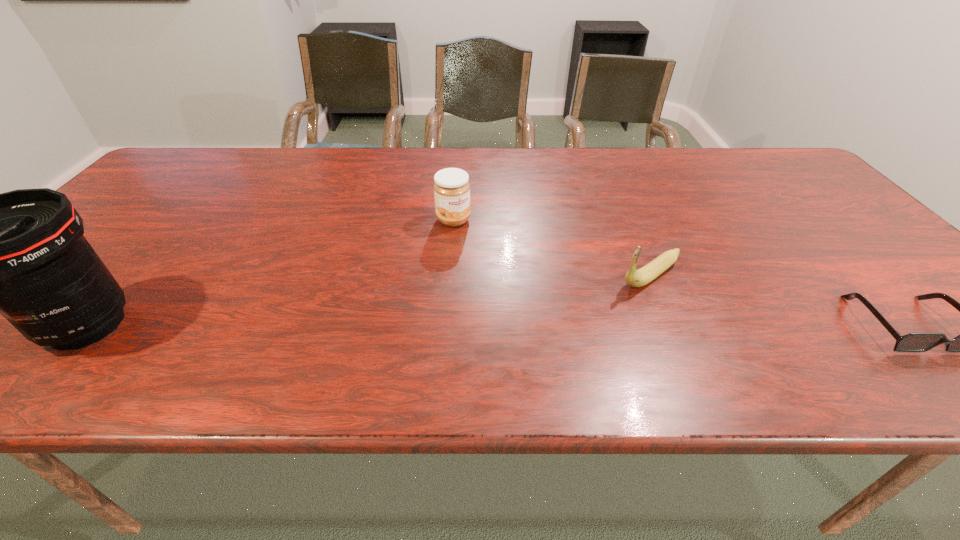
Identify the location of telephoto lens. This screenshot has width=960, height=540. (22, 253).

Locate an element on the screen. The height and width of the screenshot is (540, 960). the leftmost object is located at coordinates (22, 253).

The width and height of the screenshot is (960, 540). Find the location of `the farthest object`. the farthest object is located at coordinates (451, 188).

This screenshot has width=960, height=540. I want to click on jam, so click(451, 188).

This screenshot has width=960, height=540. What are the coordinates of `banana` in the screenshot? It's located at (636, 278).

This screenshot has width=960, height=540. In order to click on free space located 0.160m on the right of the tallest object in this screenshot , I will do `click(213, 325)`.

The height and width of the screenshot is (540, 960). In order to click on free space located on the front label of the second object from left to right in this screenshot , I will do `click(480, 247)`.

Where is `vacant space situated on the front label of the second object from left to right`? The image size is (960, 540). vacant space situated on the front label of the second object from left to right is located at coordinates (501, 270).

This screenshot has width=960, height=540. Identify the location of free space located 0.280m on the front label of the second object from left to right. (524, 293).

The width and height of the screenshot is (960, 540). Find the location of `vacant space located 0.190m at the stem of the banana`. vacant space located 0.190m at the stem of the banana is located at coordinates (568, 327).